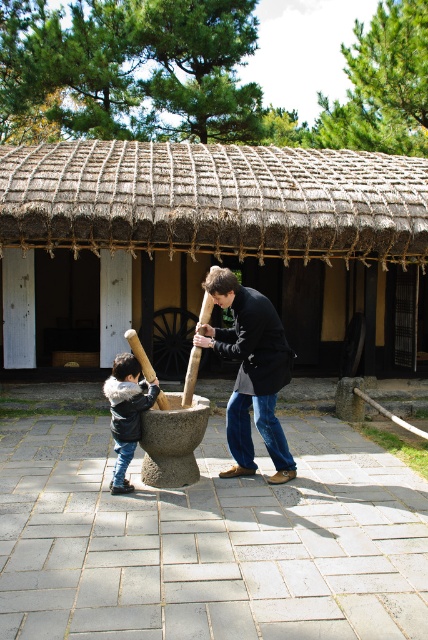
Locate an element on the screen. black fuzzy jacket at left is located at coordinates (127, 412).

Looking at this image, is black fuzzy jacket at left positioned at the back of wooden textured baseball bat at center?

No, black fuzzy jacket at left is in front of wooden textured baseball bat at center.

This screenshot has height=640, width=428. Identify the location of black fuzzy jacket at left. (127, 412).

Can you confirm if thatched straw hut at center is bigger than wooden textured baseball bat at center?

Indeed, thatched straw hut at center has a larger size compared to wooden textured baseball bat at center.

Between thatched straw hut at center and wooden textured baseball bat at center, which one appears on the right side from the viewer's perspective?

wooden textured baseball bat at center

Between point (56, 241) and point (190, 380), which one is positioned behind?

The point (56, 241) is behind.

Where is `thatched straw hut at center`? thatched straw hut at center is located at coordinates (210, 248).

Describe the element at coordinates (210, 248) in the screenshot. I see `thatched straw hut at center` at that location.

Identify the location of thatched straw hut at center. (210, 248).

Locate an element on the screen. Image resolution: width=428 pixels, height=640 pixels. thatched straw hut at center is located at coordinates (210, 248).